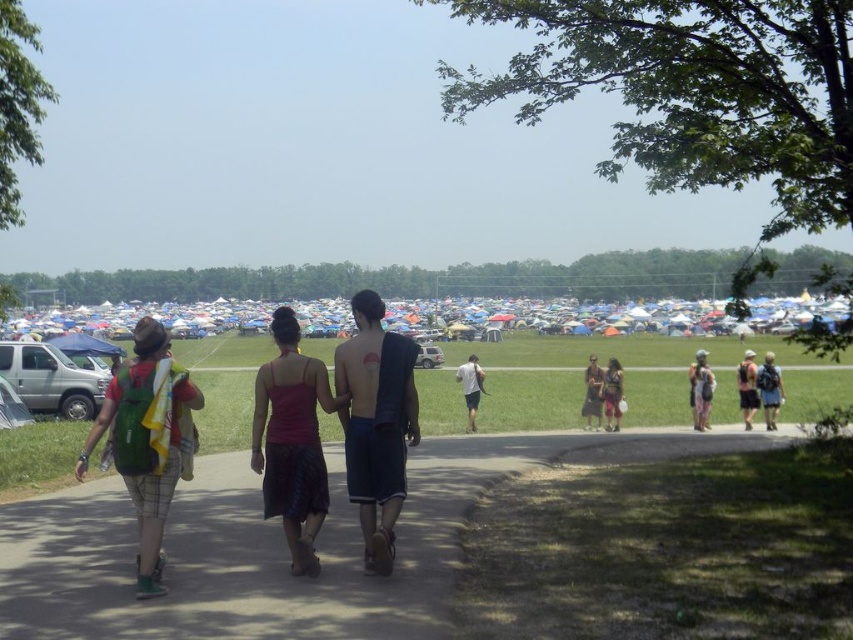
Can you confirm if shiny blue shorts at center is positioned below silver metallic van at left?

Correct, shiny blue shorts at center is located below silver metallic van at left.

Is point (370, 452) behind point (93, 396)?

That is False.

Find the location of a particular element. This screenshot has width=853, height=640. shiny blue shorts at center is located at coordinates (376, 422).

At what (x,y) coordinates should I click in order to perform the action: click on shiny blue shorts at center. Please return your answer as a coordinate pair (x, y). Image resolution: width=853 pixels, height=640 pixels. Looking at the image, I should click on 376,422.

Does point (469, 378) lie behind point (592, 385)?

Yes, point (469, 378) is farther from viewer.

Can you confirm if light gray fabric shorts at center is shorter than matte black dress at center?

Indeed, light gray fabric shorts at center has a lesser height compared to matte black dress at center.

Is point (465, 364) more distant than point (589, 364)?

That is False.

Identify the location of light gray fabric shorts at center. Image resolution: width=853 pixels, height=640 pixels. (469, 387).

Measure the distance between point (x=120, y=470) and camera.

The distance of point (x=120, y=470) from camera is 21.93 feet.

Does point (173, 488) come in front of point (440, 356)?

Yes.

At what (x,y) coordinates should I click in order to perform the action: click on green fabric backpack at left. Please return your answer as a coordinate pair (x, y). This screenshot has width=853, height=640. Looking at the image, I should click on (144, 440).